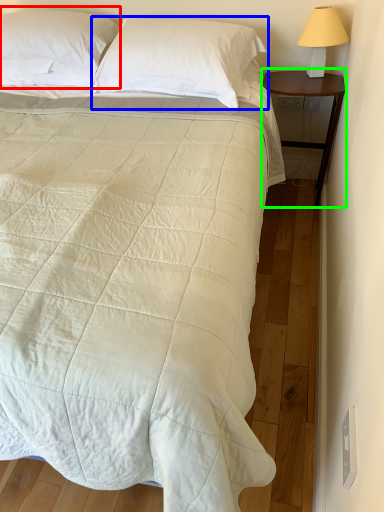
Question: Estimate the real-world distances between objects in this image. Which object is farther from pillow (highlighted by a red box), pillow (highlighted by a blue box) or nightstand (highlighted by a green box)?

Choices:
 (A) pillow
 (B) nightstand

Answer: (B)